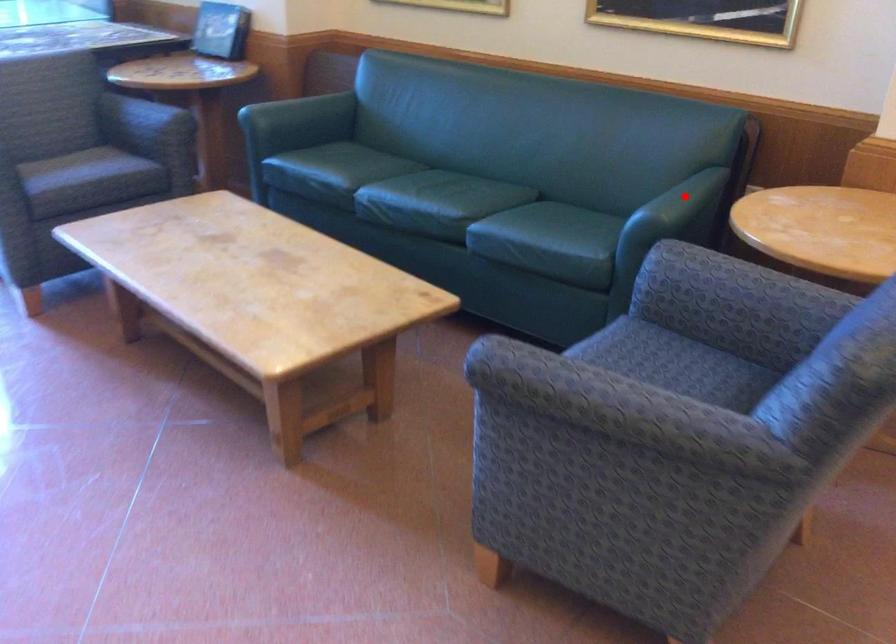
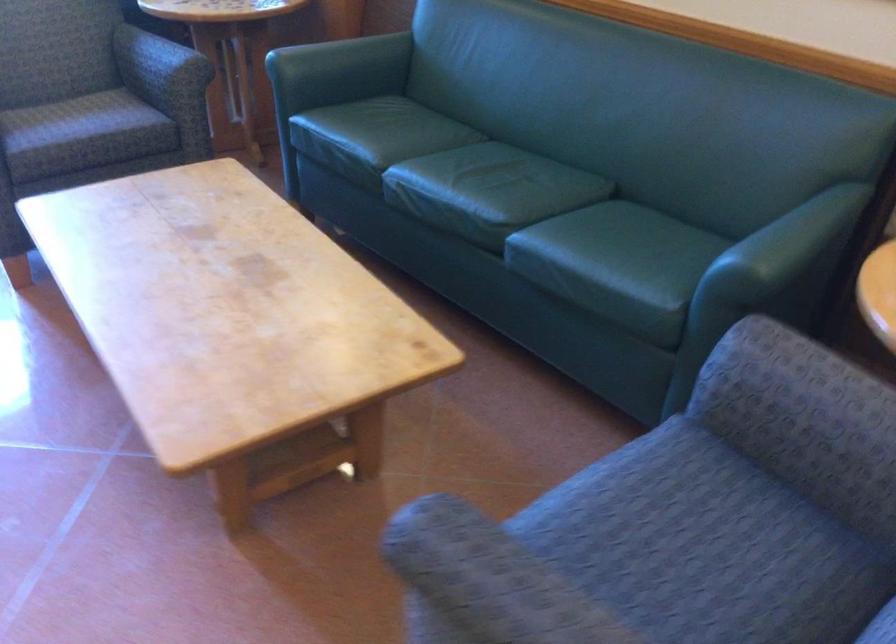
Find the pixel in the second image that matches the highlighted location in the first image.

(791, 238)